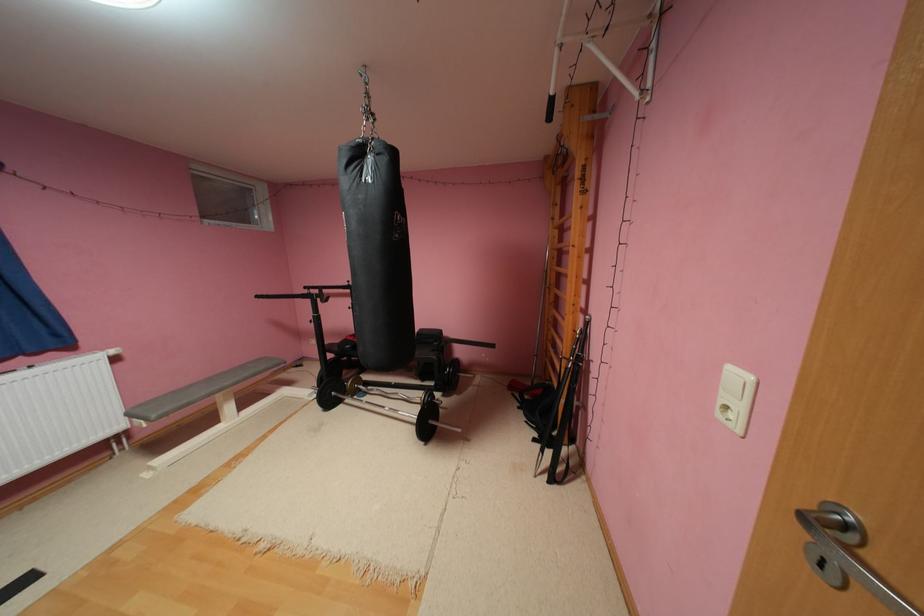
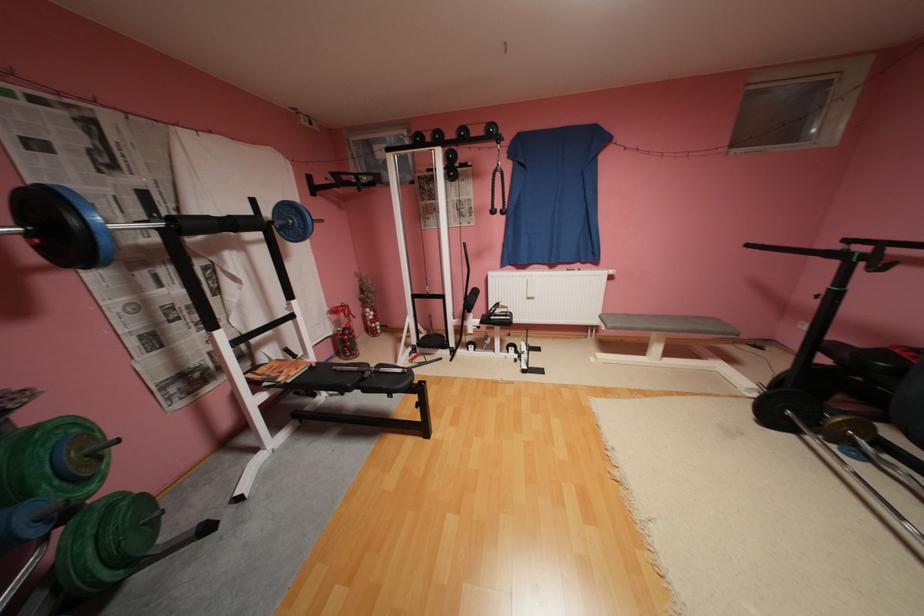
Locate, in the second image, the point that corresponds to (225,387) in the first image.

(664, 326)